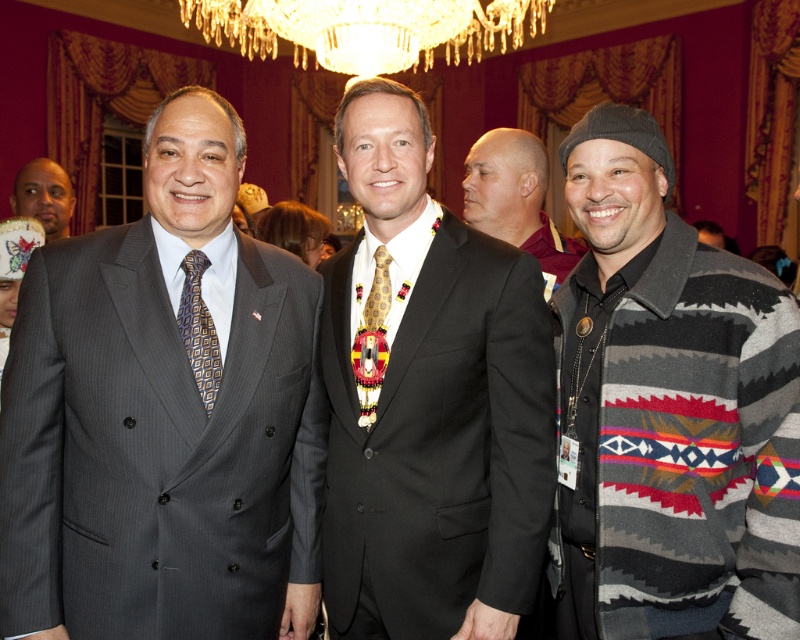
You are a photographer at a formal event. You need to adjust the lighting for a group photo. The camera you are using has a maximum focus range of 4 meters. Can you focus on both the knit sweater at right and the black suit at center at the same time?

The distance between the knit sweater at right and the black suit at center is 4.38 meters, which exceeds the camera maximum focus range of 4 meters. Therefore, you cannot focus on both at the same time.

You are a photographer adjusting camera settings for a group photo. You need to ensure that the black suit at center and the geometric patterned silk tie at left are both in focus. Based on their positions, which object should you prioritize focusing on to ensure depth of field?

The geometric patterned silk tie at left should be prioritized for focus because it is closer to the camera than the black suit at center, ensuring better depth of field.

You are a photographer adjusting the lighting for a portrait. You notice the black suit at center and the geometric patterned silk tie at left in the frame. Which object should you focus on first if you want to adjust the lighting for the narrower one?

The black suit at center is thinner than the geometric patterned silk tie at left, so you should focus on the black suit at center first since it is narrower.